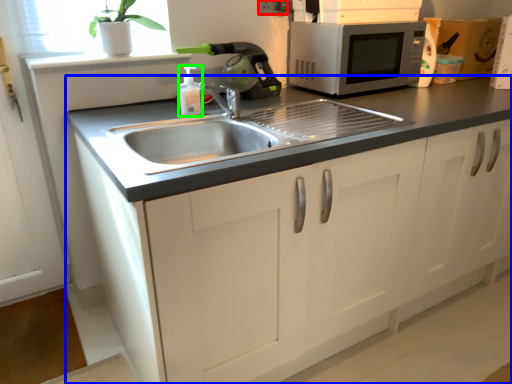
Question: Considering the real-world distances, which object is closest to electric outlet (highlighted by a red box)? cabinetry (highlighted by a blue box) or bottle (highlighted by a green box).

Choices:
 (A) cabinetry
 (B) bottle

Answer: (B)